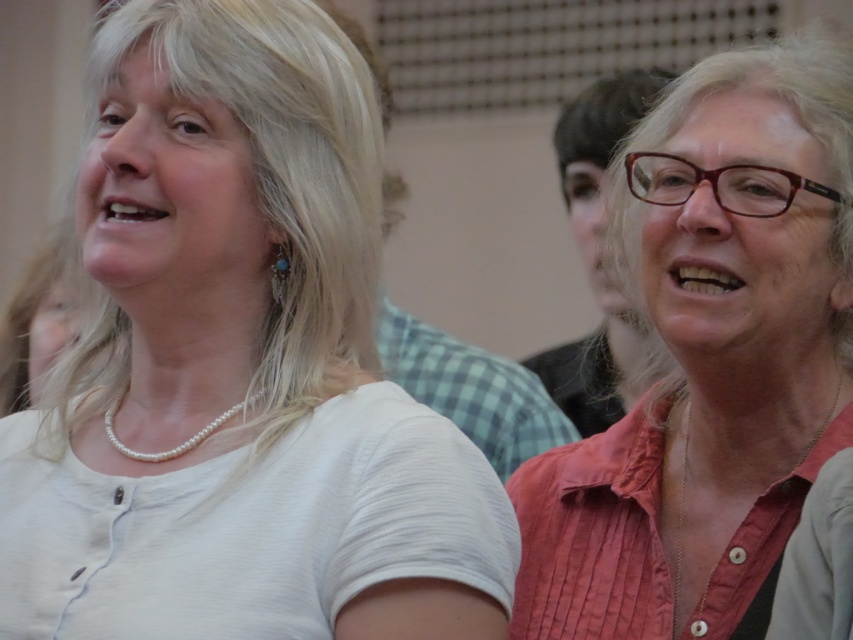
You are taking a photo of the two people in the scene. You want to focus on the person closer to the camera. Which point should you focus on, point (556, 362) or point (113, 435)?

Point (556, 362) is further to the camera than point (113, 435), so you should focus on point (556, 362) to capture the person closer to the camera.

You are at a social gathering and notice two shirts in the crowd. The pink fabric shirt at center and the matte black shirt at right. Which shirt is lower in position?

The pink fabric shirt at center is positioned under the matte black shirt at right, so it is lower in position.

You are standing in a crowded room and want to hand a note to the person wearing the checkered fabric shirt at center without approaching the person wearing the matte black shirt at right. Is this possible based on their positions?

The matte black shirt at right is closer to you than the checkered fabric shirt at center, so you can hand the note to the checkered fabric shirt at center without getting close to the matte black shirt at right by reaching around or stepping back slightly.